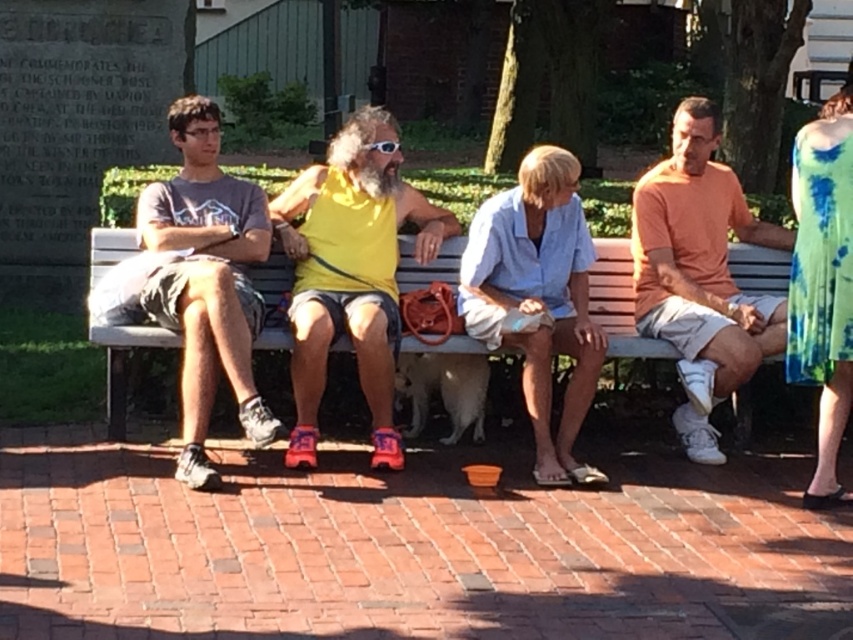
You are a park visitor trying to sit on the wooden bench at center. There is a yellow matte tank top at center already occupying space. Can you sit next to it without overlapping?

The yellow matte tank top at center is wider than the wooden bench at center, so there is no space left for you to sit next to it without overlapping.